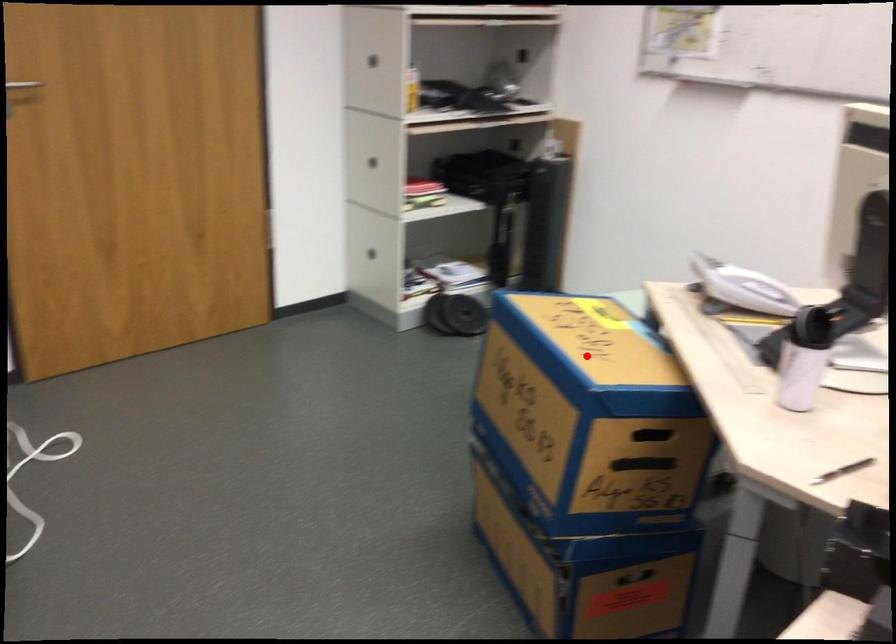
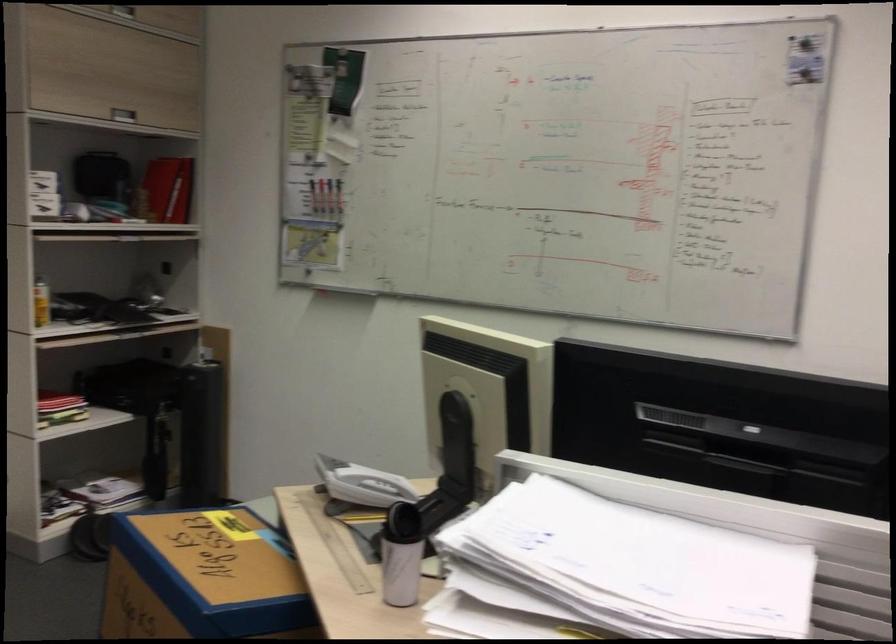
Locate, in the second image, the point that corresponds to the highlighted location in the first image.

(202, 578)